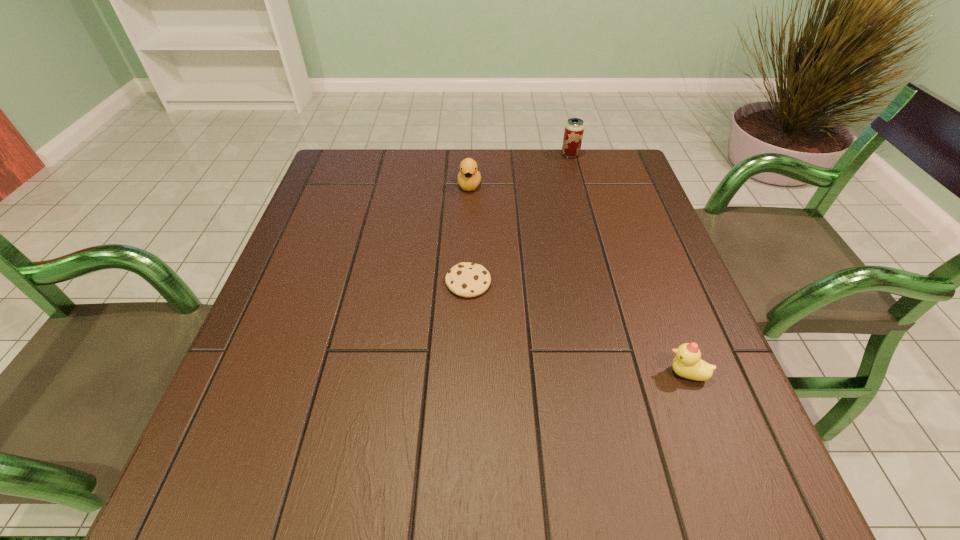
The width and height of the screenshot is (960, 540). I want to click on vacant area between the second nearest object and the farther duckling, so click(468, 234).

Find the location of a particular element. This screenshot has width=960, height=540. vacant space that is in between the second nearest object and the nearer duckling is located at coordinates (577, 328).

This screenshot has height=540, width=960. Find the location of `vacant point located between the left duckling and the tallest object`. vacant point located between the left duckling and the tallest object is located at coordinates tap(520, 170).

Identify the location of vacant region between the second farthest object and the nearest object. (578, 279).

The height and width of the screenshot is (540, 960). Find the location of `free space between the third object from left to right and the nearer duckling`. free space between the third object from left to right and the nearer duckling is located at coordinates (628, 264).

Locate an element on the screen. This screenshot has height=540, width=960. the second closest object to the cookie is located at coordinates (688, 363).

This screenshot has width=960, height=540. What are the coordinates of `object that is the closest to the beer can` in the screenshot? It's located at (468, 178).

This screenshot has width=960, height=540. I want to click on vacant space that satisfies the following two spatial constraints: 1. facing forward on the second nearest object; 2. on the right side of the farther duckling, so click(467, 282).

What are the coordinates of `free location that satisfies the following two spatial constraints: 1. facing forward on the cookie; 2. on the left side of the second farthest object` in the screenshot? It's located at (467, 282).